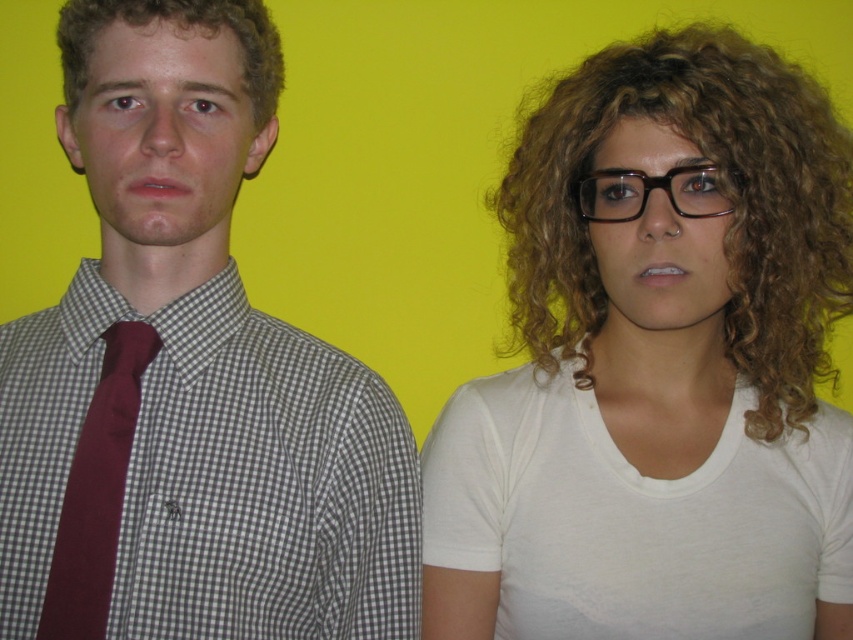
Does curly blonde hair at right have a smaller size compared to maroon fabric tie at left?

Incorrect, curly blonde hair at right is not smaller in size than maroon fabric tie at left.

Does curly blonde hair at right have a larger size compared to maroon fabric tie at left?

Yes, curly blonde hair at right is bigger than maroon fabric tie at left.

Is point (701, 54) farther from viewer compared to point (96, 476)?

Yes, it is.

The image size is (853, 640). What are the coordinates of `curly blonde hair at right` in the screenshot? It's located at (720, 188).

Is maroon fabric tie at left positioned in front of black plastic glasses at center?

Yes, it is in front of black plastic glasses at center.

Does maroon fabric tie at left have a greater width compared to black plastic glasses at center?

No.

Who is more forward, (132, 321) or (693, 170)?

Point (693, 170) is in front.

Locate an element on the screen. This screenshot has height=640, width=853. maroon fabric tie at left is located at coordinates (96, 490).

From the picture: Between curly blonde hair at left and black plastic glasses at center, which one is positioned lower?

black plastic glasses at center

Who is taller, curly blonde hair at left or black plastic glasses at center?

With more height is curly blonde hair at left.

Locate an element on the screen. This screenshot has height=640, width=853. curly blonde hair at left is located at coordinates (178, 28).

I want to click on curly blonde hair at left, so click(x=178, y=28).